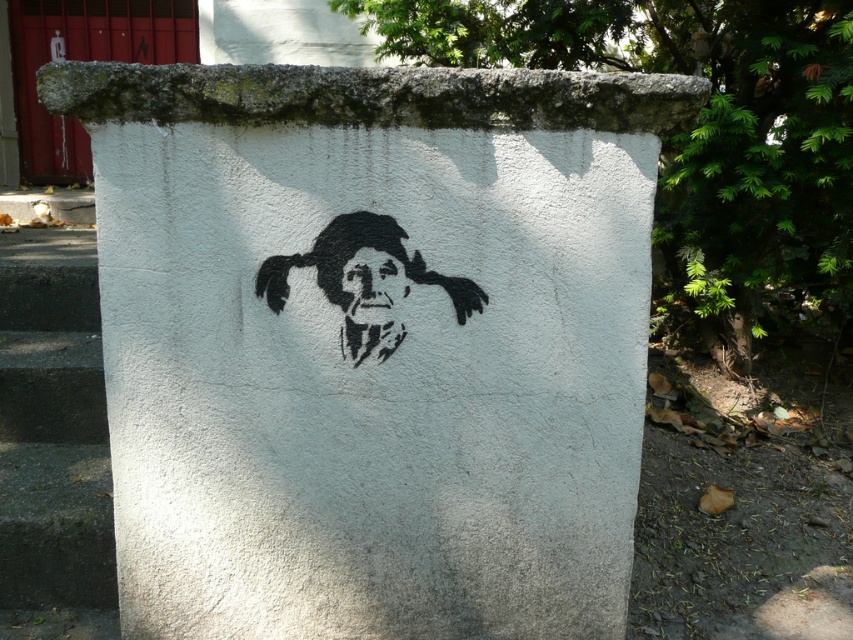
Does black spray paint at center have a greater width compared to black stencil face at center?

Yes.

Can you confirm if black spray paint at center is thinner than black stencil face at center?

No.

Is point (350, 284) closer to camera compared to point (397, 301)?

Yes, it is in front of point (397, 301).

Locate an element on the screen. black spray paint at center is located at coordinates (364, 282).

Between white concrete wall at center and concrete stairs at lower left, which one has more height?

Standing taller between the two is white concrete wall at center.

Is white concrete wall at center wider than concrete stairs at lower left?

Yes.

Find the location of a particular element. white concrete wall at center is located at coordinates (372, 342).

At what (x,y) coordinates should I click in order to perform the action: click on white concrete wall at center. Please return your answer as a coordinate pair (x, y). Looking at the image, I should click on (372, 342).

Is concrete stairs at lower left to the left of black stencil face at center from the viewer's perspective?

Indeed, concrete stairs at lower left is positioned on the left side of black stencil face at center.

Is point (0, 595) closer to viewer compared to point (352, 260)?

No, (0, 595) is further to viewer.

Locate an element on the screen. This screenshot has width=853, height=640. concrete stairs at lower left is located at coordinates (53, 440).